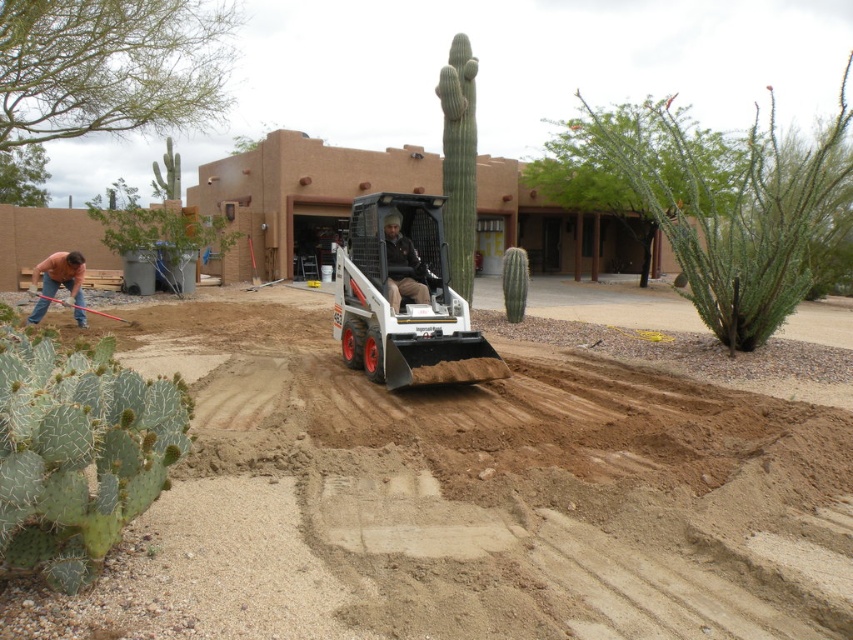
The image size is (853, 640). What do you see at coordinates (404, 298) in the screenshot? I see `white rubber skid steer loader at center` at bounding box center [404, 298].

Who is positioned more to the left, white rubber skid steer loader at center or matte pink shirt at left?

matte pink shirt at left

Does point (444, 266) come in front of point (49, 285)?

That is True.

Locate an element on the screen. This screenshot has width=853, height=640. white rubber skid steer loader at center is located at coordinates (404, 298).

Can you confirm if brown gravel at center is smaller than matte pink shirt at left?

No, brown gravel at center is not smaller than matte pink shirt at left.

Is brown gravel at center to the left of matte pink shirt at left from the viewer's perspective?

In fact, brown gravel at center is to the right of matte pink shirt at left.

The width and height of the screenshot is (853, 640). Find the location of `brown gravel at center`. brown gravel at center is located at coordinates (462, 500).

Does white rubber skid steer loader at center have a lesser width compared to dark brown leather jacket at center?

Incorrect, white rubber skid steer loader at center's width is not less than dark brown leather jacket at center's.

Find the location of `white rubber skid steer loader at center`. white rubber skid steer loader at center is located at coordinates (404, 298).

You are a GUI agent. You are given a task and a screenshot of the screen. Output one action in this format:
    pyautogui.click(x=<x>, y=<y>)
    Task: Click on the white rubber skid steer loader at center
    This screenshot has width=853, height=640.
    Given the screenshot: What is the action you would take?
    pyautogui.click(x=404, y=298)